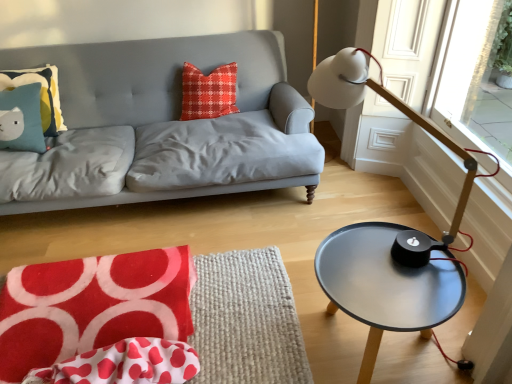
Question: Can you confirm if white polka dot fabric at lower left is taller than matte blue pillow with cat design at upper left, which is the first pillow in left-to-right order?

Choices:
 (A) yes
 (B) no

Answer: (B)

Question: Is white polka dot fabric at lower left closer to camera compared to matte blue pillow with cat design at upper left, which is the second pillow from right to left?

Choices:
 (A) no
 (B) yes

Answer: (B)

Question: From the image's perspective, is white polka dot fabric at lower left located beneath matte blue pillow with cat design at upper left, which is the first pillow in left-to-right order?

Choices:
 (A) no
 (B) yes

Answer: (B)

Question: Is white polka dot fabric at lower left with matte blue pillow with cat design at upper left, which is the first pillow in left-to-right order?

Choices:
 (A) yes
 (B) no

Answer: (B)

Question: Would you say white polka dot fabric at lower left is outside matte blue pillow with cat design at upper left, which is the first pillow in left-to-right order?

Choices:
 (A) no
 (B) yes

Answer: (B)

Question: Looking at the image, does white polka dot fabric at lower left seem bigger or smaller compared to matte blue pillow with cat design at upper left, which is the second pillow from right to left?

Choices:
 (A) big
 (B) small

Answer: (B)

Question: Does point (76, 370) appear closer or farther from the camera than point (46, 114)?

Choices:
 (A) farther
 (B) closer

Answer: (B)

Question: Is white polka dot fabric at lower left situated inside matte blue pillow with cat design at upper left, which is the second pillow from right to left, or outside?

Choices:
 (A) inside
 (B) outside

Answer: (B)

Question: In terms of width, does white polka dot fabric at lower left look wider or thinner when compared to matte blue pillow with cat design at upper left, which is the second pillow from right to left?

Choices:
 (A) wide
 (B) thin

Answer: (B)

Question: Is matte gray fabric couch at upper left bigger or smaller than red plaid pillow at center, which is the 2th pillow in left-to-right order?

Choices:
 (A) small
 (B) big

Answer: (B)

Question: Is point (307, 175) positioned closer to the camera than point (185, 119)?

Choices:
 (A) farther
 (B) closer

Answer: (B)

Question: Relative to red plaid pillow at center, which is the 2th pillow in left-to-right order, is matte gray fabric couch at upper left in front or behind?

Choices:
 (A) behind
 (B) front

Answer: (B)

Question: Considering the positions of matte gray fabric couch at upper left and red plaid pillow at center, the first pillow positioned from the right, in the image, is matte gray fabric couch at upper left wider or thinner than red plaid pillow at center, the first pillow positioned from the right,?

Choices:
 (A) thin
 (B) wide

Answer: (B)

Question: From a real-world perspective, is red plaid pillow at center, the first pillow positioned from the right, physically located above or below metallic gray table at right?

Choices:
 (A) above
 (B) below

Answer: (A)

Question: From the image's perspective, is red plaid pillow at center, which is the 2th pillow in left-to-right order, above or below metallic gray table at right?

Choices:
 (A) above
 (B) below

Answer: (A)